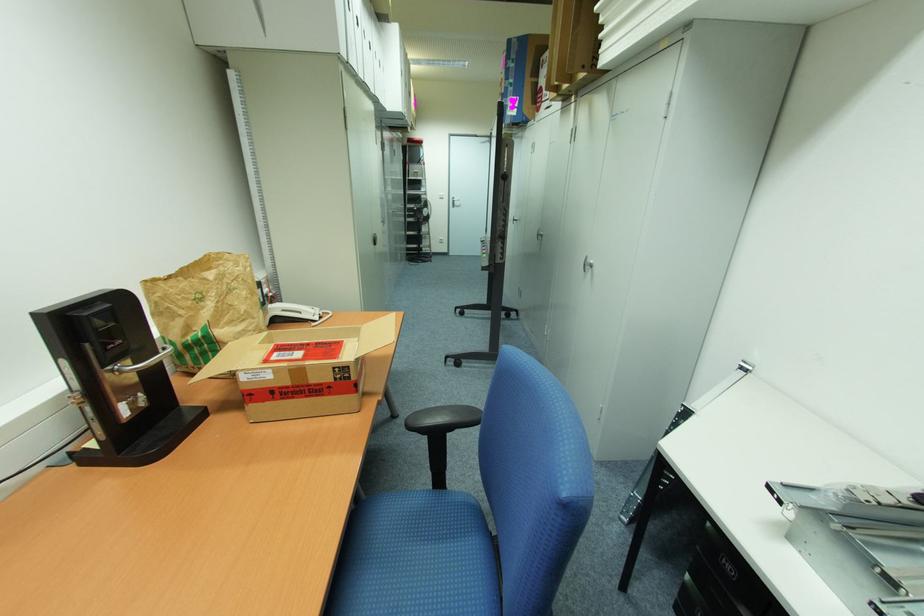
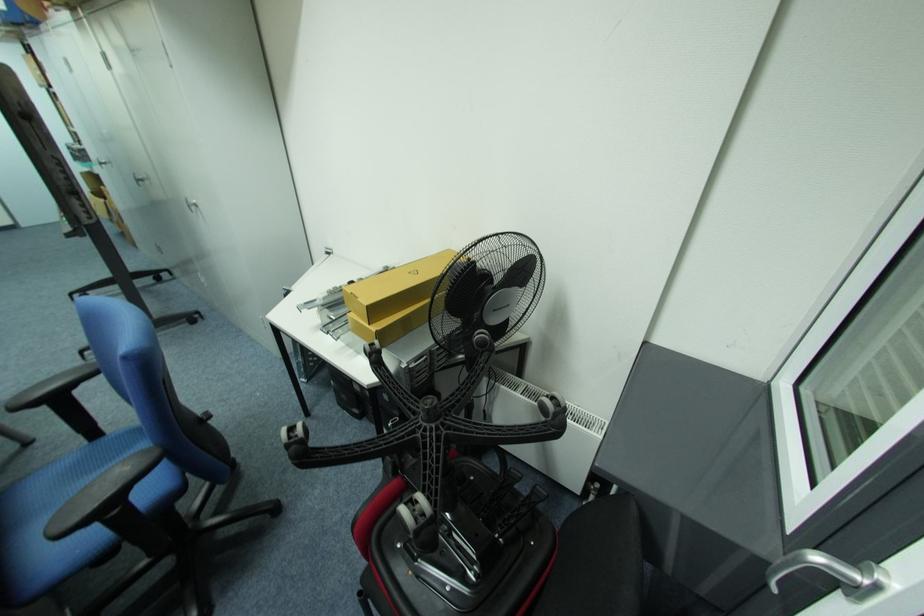
How did the camera likely rotate?

The rotation direction of the camera is right-down.